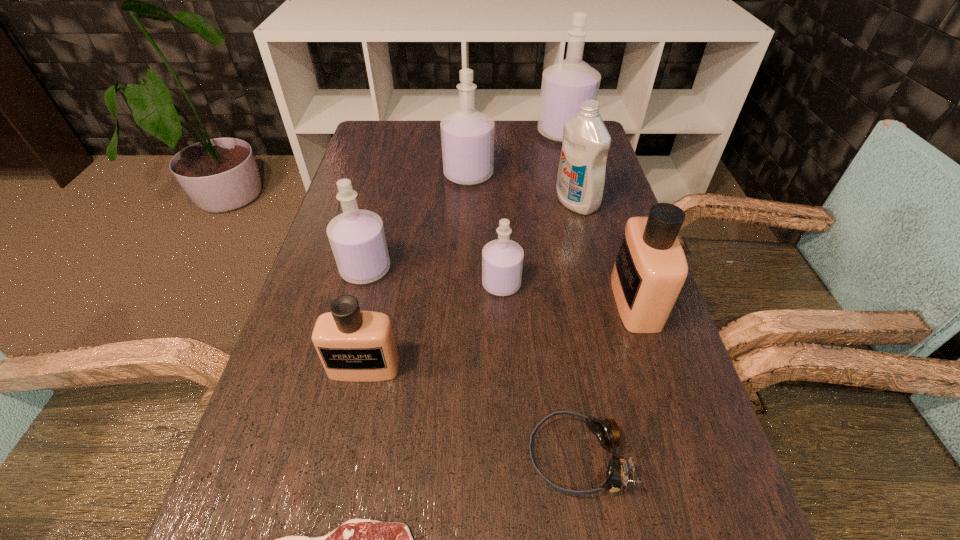
Locate an element on the screen. vacant space at the left edge of the desktop is located at coordinates (302, 402).

Image resolution: width=960 pixels, height=540 pixels. Identify the location of free spot at the right edge of the desktop. (700, 428).

I want to click on vacant position at the far left corner of the desktop, so click(x=400, y=124).

Identify the location of free space that is in between the white detergent and the eighth farthest object. The width and height of the screenshot is (960, 540). (577, 329).

The image size is (960, 540). Find the location of `vacant area between the detergent and the nearest perfume`. vacant area between the detergent and the nearest perfume is located at coordinates (470, 285).

You are a GUI agent. You are given a task and a screenshot of the screen. Output one action in this format:
    pyautogui.click(x=<x>, y=<y>)
    Task: Click on the unoccupied area between the goggles and the bigger beige perfume
    
    Given the screenshot: What is the action you would take?
    pyautogui.click(x=606, y=379)

Locate an element on the screen. The width and height of the screenshot is (960, 540). vacant point located between the smallest purple perfume and the second smallest purple perfume is located at coordinates (434, 276).

At what (x,y) coordinates should I click in order to perform the action: click on vacant area between the bigger beige perfume and the second shortest object. Please return your answer as a coordinate pair (x, y). The width and height of the screenshot is (960, 540). Looking at the image, I should click on (606, 379).

The width and height of the screenshot is (960, 540). I want to click on vacant area that lies between the goggles and the second farthest perfume, so click(523, 315).

At what (x,y) coordinates should I click in order to perform the action: click on vacant space in between the eighth tallest object and the smallest purple perfume. Please return your answer as a coordinate pair (x, y). This screenshot has height=540, width=960. Looking at the image, I should click on (540, 370).